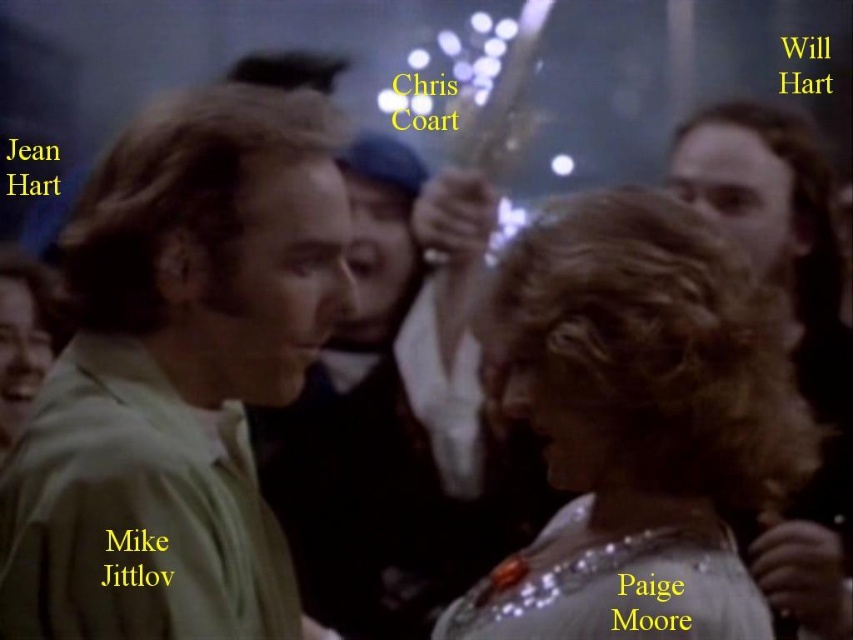
Measure the distance between satin silver dress at center and camera.

satin silver dress at center and camera are 32.89 inches apart.

Can you confirm if satin silver dress at center is taller than smooth black shirt at center?

No.

Is point (699, 413) positioned in front of point (257, 454)?

Yes, point (699, 413) is closer to viewer.

Where is `satin silver dress at center`? The height and width of the screenshot is (640, 853). satin silver dress at center is located at coordinates (637, 426).

Between smooth black shirt at center and dark brown hair at right, which one has less height?

dark brown hair at right is shorter.

In the scene shown: Which is more to the right, smooth black shirt at center or dark brown hair at right?

dark brown hair at right

Describe the element at coordinates (368, 436) in the screenshot. I see `smooth black shirt at center` at that location.

Find the location of `smooth black shirt at center`. smooth black shirt at center is located at coordinates (368, 436).

Is green matte shirt at left above dark brown hair at right?

No.

What do you see at coordinates (177, 376) in the screenshot? I see `green matte shirt at left` at bounding box center [177, 376].

You are a GUI agent. You are given a task and a screenshot of the screen. Output one action in this format:
    pyautogui.click(x=<x>, y=<y>)
    Task: Click on the green matte shirt at left
    The image size is (853, 640).
    Given the screenshot: What is the action you would take?
    pyautogui.click(x=177, y=376)